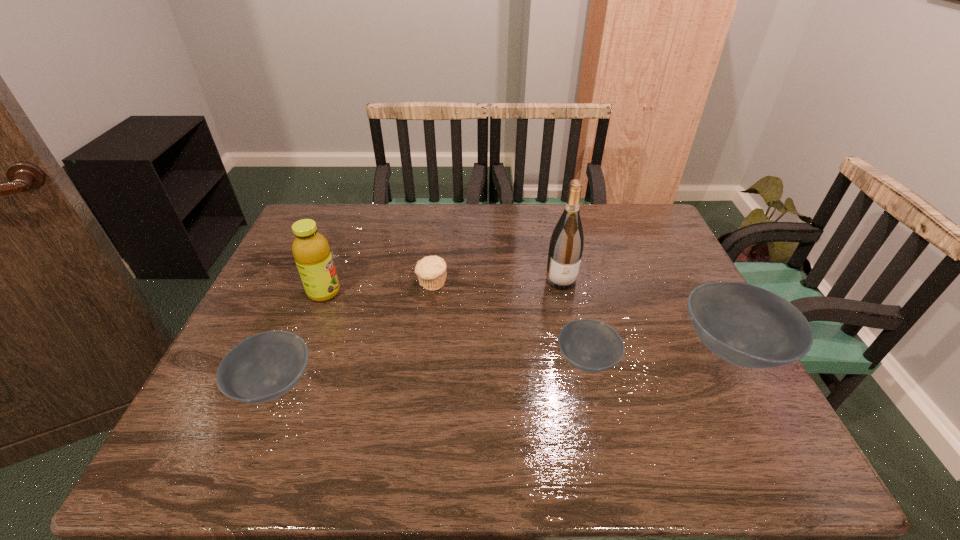
This screenshot has width=960, height=540. I want to click on vacant space that satisfies the following two spatial constraints: 1. on the back side of the fourth object from right to left; 2. on the left side of the second tallest bowl, so click(317, 284).

This screenshot has height=540, width=960. In order to click on vacant area in the image that satisfies the following two spatial constraints: 1. on the label of the tallest object; 2. on the right side of the rightmost bowl in this screenshot , I will do `click(575, 349)`.

At what (x,y) coordinates should I click in order to perform the action: click on free point that satisfies the following two spatial constraints: 1. on the front side of the third object from left to right; 2. on the right side of the tallest bowl. Please return your answer as a coordinate pair (x, y). This screenshot has height=540, width=960. Looking at the image, I should click on (424, 349).